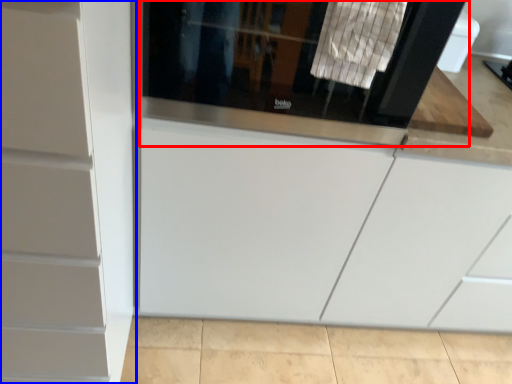
Question: Which of the following is the farthest to the observer, screen door (highlighted by a red box) or cabinetry (highlighted by a blue box)?

Choices:
 (A) screen door
 (B) cabinetry

Answer: (A)